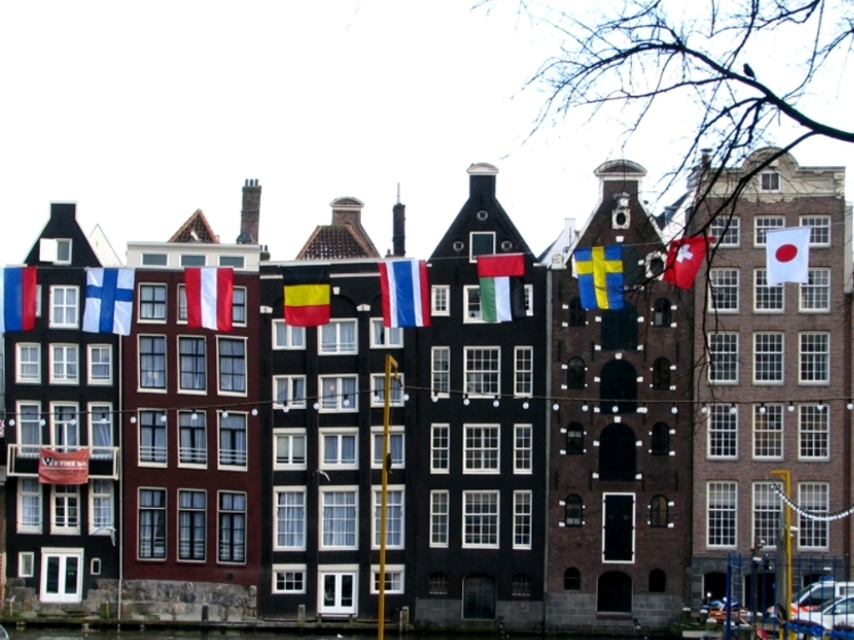
Question: Does white fabric flag at upper left have a smaller size compared to yellowmaterial/textureflag at center?

Choices:
 (A) yes
 (B) no

Answer: (B)

Question: Estimate the real-world distances between objects in this image. Which object is farther from the matte red flag at center?

Choices:
 (A) yellow and black striped flag at center
 (B) blue and white striped flag at center

Answer: (B)

Question: Which object is positioned farthest from the matte red flag at lower left?

Choices:
 (A) green fabric flag at center
 (B) matte red flag at center

Answer: (A)

Question: Which of the following is the closest to the observer?

Choices:
 (A) blue and white striped flag at center
 (B) matte red flag at lower left
 (C) white fabric flag at upper left

Answer: (A)

Question: Is white fabric flag at upper left to the left of yellowmaterial/textureflag at center from the viewer's perspective?

Choices:
 (A) no
 (B) yes

Answer: (B)

Question: Is blue and white striped flag at center positioned in front of white fabric flag at upper right?

Choices:
 (A) no
 (B) yes

Answer: (A)